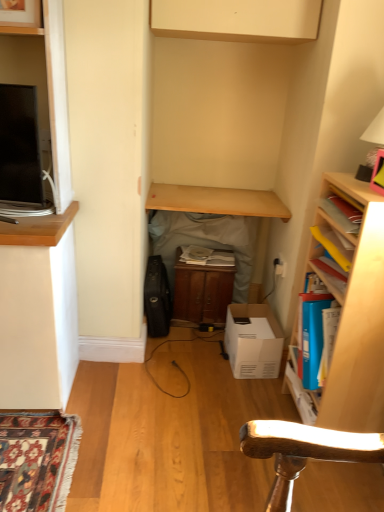
Question: Considering the positions of point (283, 273) and point (221, 212), is point (283, 273) closer or farther from the camera than point (221, 212)?

Choices:
 (A) closer
 (B) farther

Answer: (B)

Question: Considering their positions, is white plastic electric outlet at center-right located in front of or behind wooden cabinet at center, placed as the 1th table when sorted from bottom to top?

Choices:
 (A) behind
 (B) front

Answer: (B)

Question: Estimate the real-world distances between objects in this image. Which object is farther from the white plastic electric outlet at center-right?

Choices:
 (A) light wood table at center, which ranks as the second table in bottom-to-top order
 (B) wooden bookshelf at right
 (C) wooden cabinet at center, marked as the 2th table in a top-to-bottom arrangement
 (D) matte white cabinet at upper center
 (E) white matte lampshade at upper right

Answer: (D)

Question: Which of these objects is positioned closest to the white matte lampshade at upper right?

Choices:
 (A) wooden bookshelf at right
 (B) matte white cabinet at upper center
 (C) white cardboard box at center
 (D) white plastic electric outlet at center-right
 (E) wooden cabinet at center

Answer: (A)